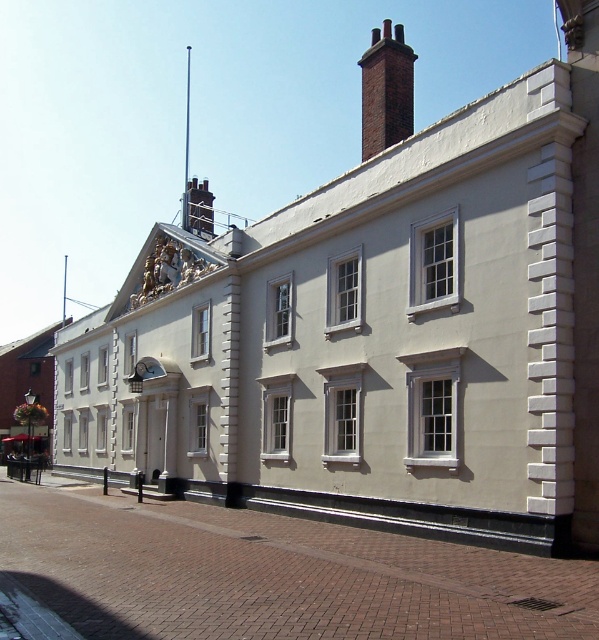
Can you confirm if brick chimney at upper center is taller than metallic clock at center?

Indeed, brick chimney at upper center has a greater height compared to metallic clock at center.

Does point (410, 108) come farther from viewer compared to point (149, 360)?

That is False.

The width and height of the screenshot is (599, 640). I want to click on brick chimney at upper center, so point(386,90).